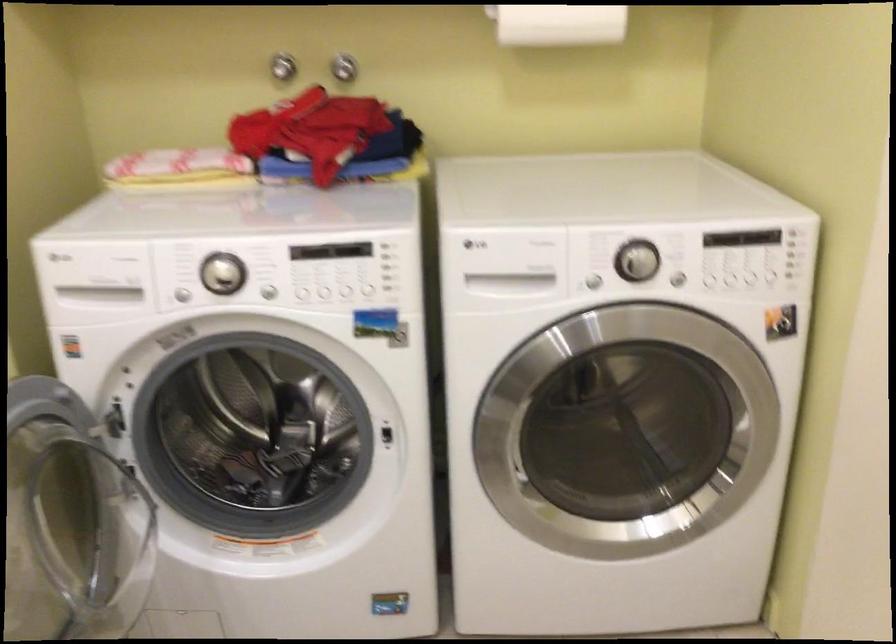
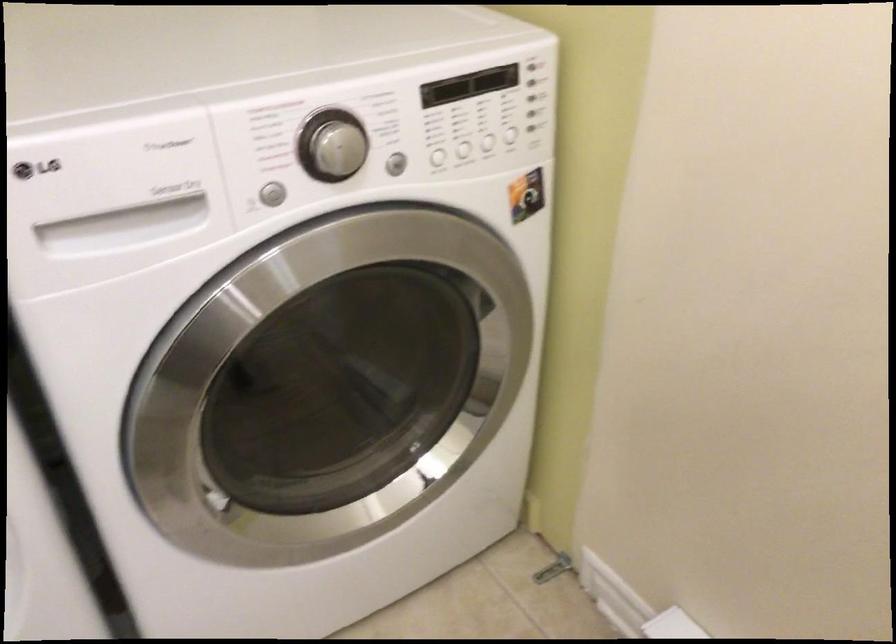
Locate, in the second image, the point that corresponds to (x=591, y=278) in the first image.

(269, 194)